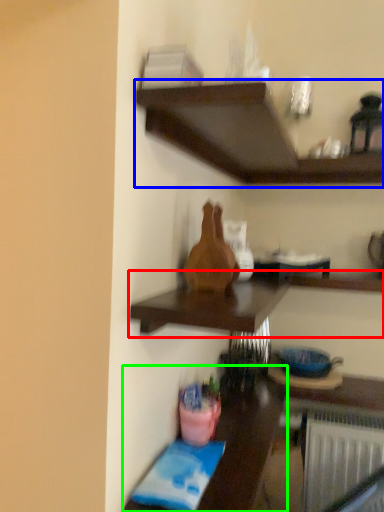
Question: Which object is the closest to the shelf (highlighted by a red box)? Choose among these: shelf (highlighted by a blue box) or table (highlighted by a green box).

Choices:
 (A) shelf
 (B) table

Answer: (B)